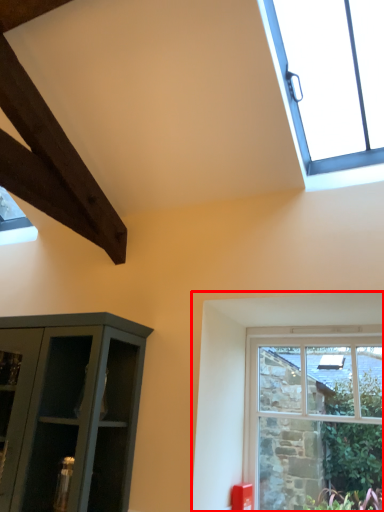
Question: In this image, where is window (annotated by the red box) located relative to window?

Choices:
 (A) right
 (B) left

Answer: (A)